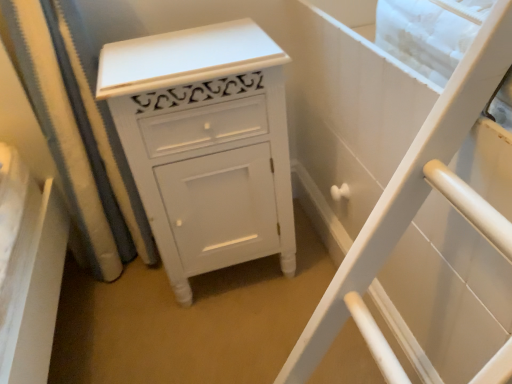
Question: In terms of width, does white fabric shower curtain at left look wider or thinner when compared to white painted wood cabinet at center?

Choices:
 (A) thin
 (B) wide

Answer: (A)

Question: Which is correct: white fabric shower curtain at left is inside white painted wood cabinet at center, or outside of it?

Choices:
 (A) inside
 (B) outside

Answer: (B)

Question: Considering their positions, is white fabric shower curtain at left located in front of or behind white painted wood cabinet at center?

Choices:
 (A) behind
 (B) front

Answer: (A)

Question: Based on their positions, is white painted wood cabinet at center located to the left or right of white fabric shower curtain at left?

Choices:
 (A) right
 (B) left

Answer: (A)

Question: In terms of height, does white painted wood cabinet at center look taller or shorter compared to white fabric shower curtain at left?

Choices:
 (A) tall
 (B) short

Answer: (B)

Question: Based on their sizes in the image, would you say white painted wood cabinet at center is bigger or smaller than white fabric shower curtain at left?

Choices:
 (A) big
 (B) small

Answer: (A)

Question: Is white painted wood cabinet at center in front of or behind white fabric shower curtain at left in the image?

Choices:
 (A) front
 (B) behind

Answer: (A)